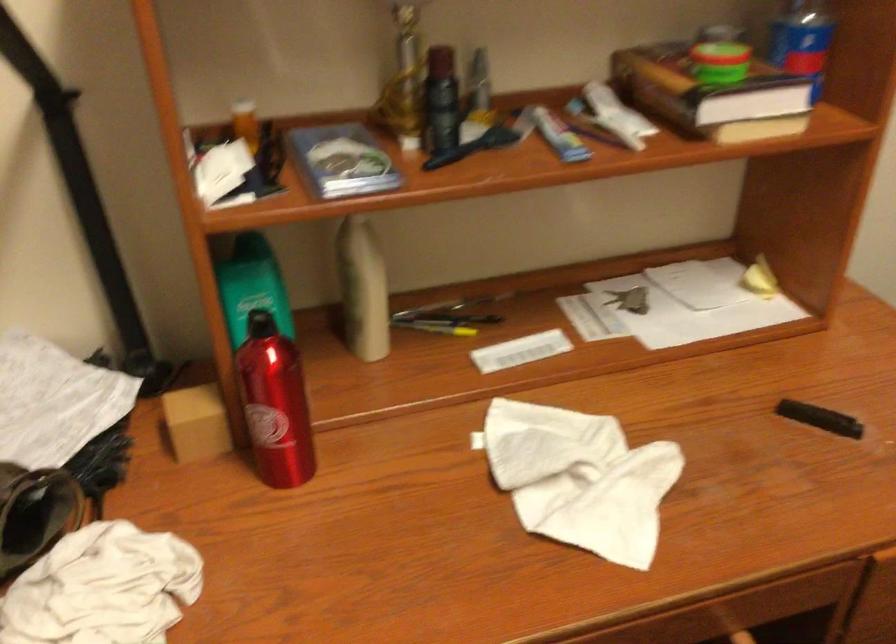
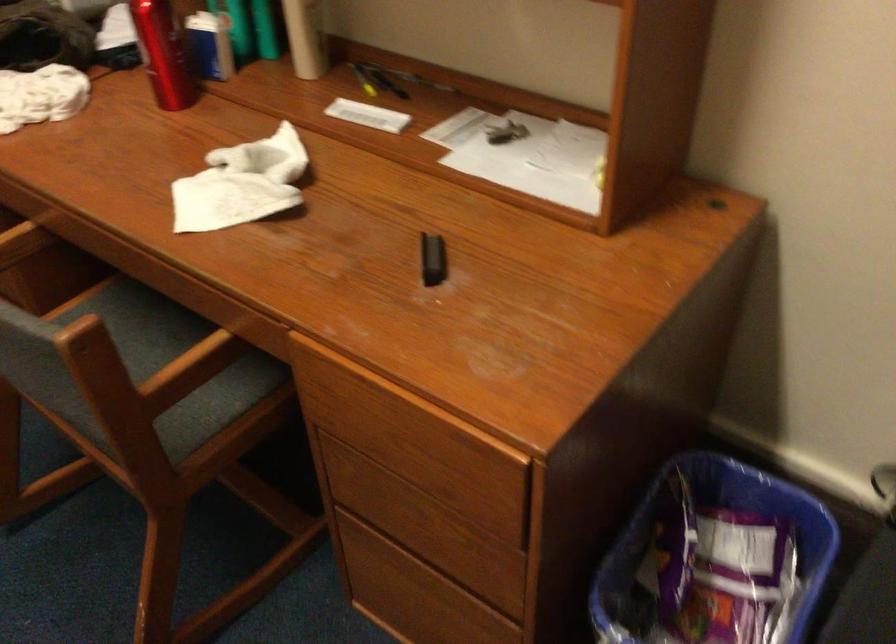
The point at (435, 319) is marked in the first image. Where is the corresponding point in the second image?

(376, 80)